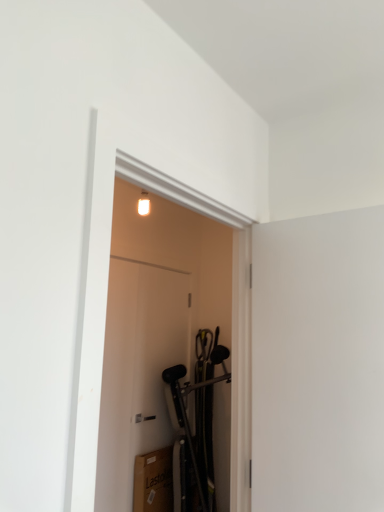
Question: Is white matte door at center, which is the second door in front-to-back order, bigger than white matte screen door at right?

Choices:
 (A) yes
 (B) no

Answer: (A)

Question: From the image's perspective, would you say white matte door at center, which is counted as the 1th door, starting from the back, is shown under white matte screen door at right?

Choices:
 (A) no
 (B) yes

Answer: (B)

Question: Does white matte door at center, which is the second door in front-to-back order, have a lesser width compared to white matte screen door at right?

Choices:
 (A) no
 (B) yes

Answer: (B)

Question: Is white matte door at center, which is the second door in front-to-back order, closer to the viewer compared to white matte screen door at right?

Choices:
 (A) no
 (B) yes

Answer: (A)

Question: Is white matte door at center, which is the second door in front-to-back order, touching white matte screen door at right?

Choices:
 (A) no
 (B) yes

Answer: (A)

Question: From a real-world perspective, is white matte door at center, which is the second door in front-to-back order, positioned under white matte screen door at right based on gravity?

Choices:
 (A) no
 (B) yes

Answer: (B)

Question: Is white glossy door at center, acting as the second door starting from the back, in contact with white matte door at center, which is the second door in front-to-back order?

Choices:
 (A) yes
 (B) no

Answer: (A)

Question: From a real-world perspective, is white glossy door at center, acting as the second door starting from the back, below white matte door at center, which is the second door in front-to-back order?

Choices:
 (A) no
 (B) yes

Answer: (A)

Question: Is white glossy door at center, acting as the second door starting from the back, far away from white matte door at center, which is counted as the 1th door, starting from the back?

Choices:
 (A) yes
 (B) no

Answer: (B)

Question: From the image's perspective, is white glossy door at center, acting as the second door starting from the back, on top of white matte door at center, which is counted as the 1th door, starting from the back?

Choices:
 (A) yes
 (B) no

Answer: (A)

Question: Is white glossy door at center, which is the first door from front to back, in front of white matte door at center, which is the second door in front-to-back order?

Choices:
 (A) no
 (B) yes

Answer: (B)

Question: From the image's perspective, would you say white glossy door at center, which is the first door from front to back, is shown under white matte door at center, which is counted as the 1th door, starting from the back?

Choices:
 (A) no
 (B) yes

Answer: (A)

Question: Is white matte door at center, which is the second door in front-to-back order, bigger than white glossy door at center, acting as the second door starting from the back?

Choices:
 (A) yes
 (B) no

Answer: (B)